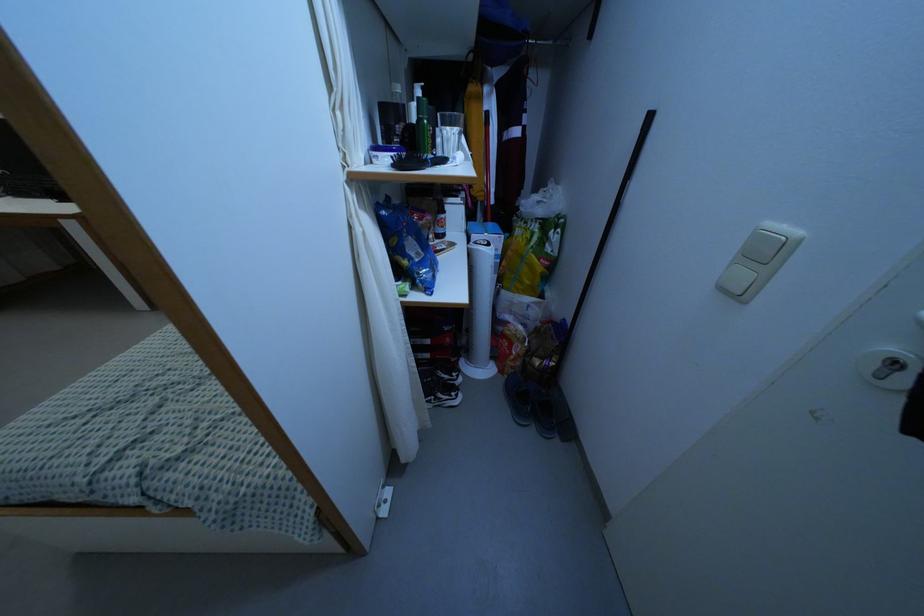
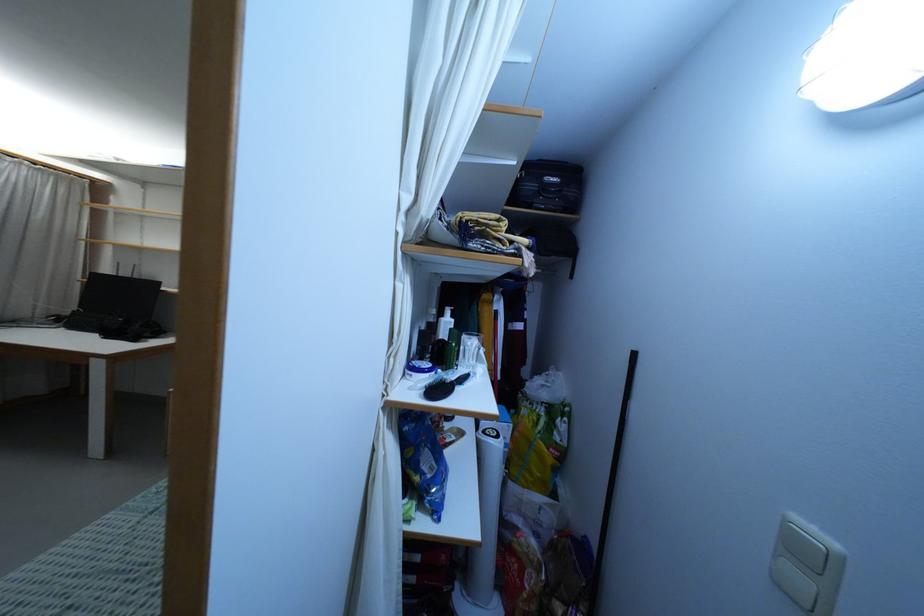
Where in the second image is the point corresponding to (743,276) from the first image?

(799, 580)